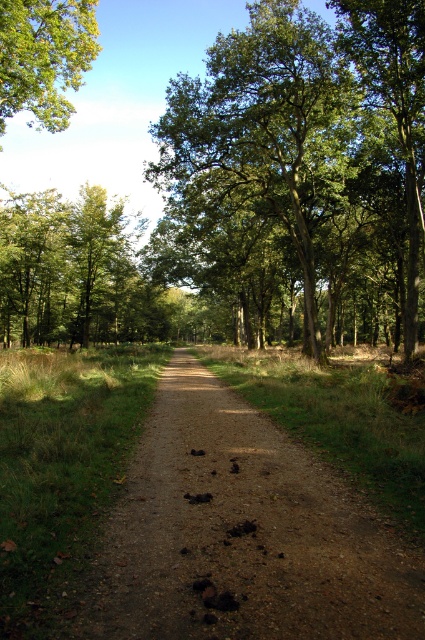
You are a hiker standing at the starting point of the forest path. You notice two points marked on your map corresponding to coordinates point (238, 116) and point (411, 246). Which point is closer to your current position?

Point (238, 116) is closer to the camera than point (411, 246), so the point (238, 116) is closer to your current position.

You are a hiker standing on the forest path and want to know which tree is higher in the image. Can you determine if the green leafy tree at center is taller than the green leafy tree at upper right?

The green leafy tree at center is above the green leafy tree at upper right, so it is positioned higher in the image. However, this does not necessarily mean it is physically taller, as perspective and placement in the scene can affect visual height.